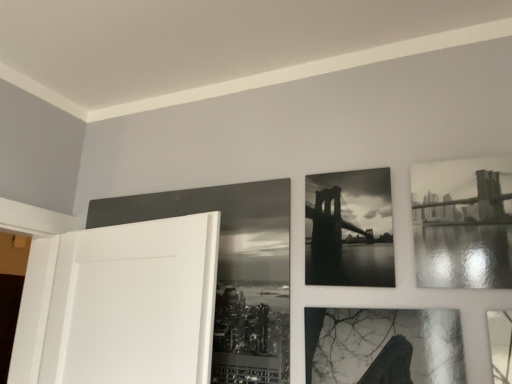
Question: Relative to black glossy picture frame at upper center, positioned as the first picture frame in left-to-right order, is black glossy photo frame at center, the 2th picture frame positioned from the right, in front or behind?

Choices:
 (A) behind
 (B) front

Answer: (B)

Question: Is point (338, 218) closer or farther from the camera than point (244, 203)?

Choices:
 (A) farther
 (B) closer

Answer: (B)

Question: Which object is positioned farthest from the black glossy photo frame at upper right, which ranks as the 3th picture frame in left-to-right order?

Choices:
 (A) black glossy picture frame at upper center, positioned as the first picture frame in left-to-right order
 (B) black glossy photo frame at center, which is the second picture frame in left-to-right order

Answer: (A)

Question: Which object is the farthest from the black glossy photo frame at center, which is the second picture frame in left-to-right order?

Choices:
 (A) black glossy picture frame at upper center, placed as the third picture frame when sorted from right to left
 (B) black glossy photo frame at upper right, which ranks as the 3th picture frame in left-to-right order

Answer: (A)